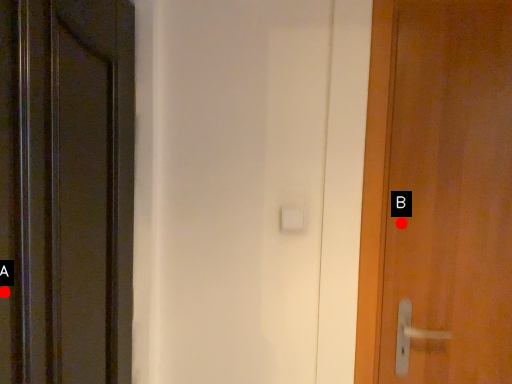
Question: Two points are circled on the image, labeled by A and B beside each circle. Among these points, which one is farthest from the camera?

Choices:
 (A) A is further
 (B) B is further

Answer: (B)